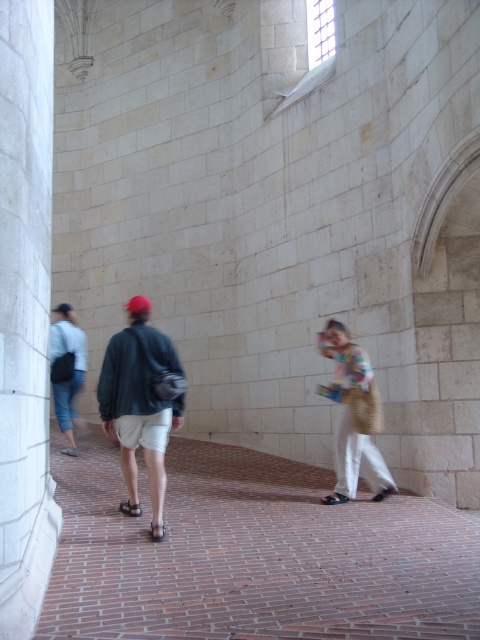
Is black leather sandal at lower left taller than brown leather sandal at lower left?

Indeed, black leather sandal at lower left has a greater height compared to brown leather sandal at lower left.

Is black leather sandal at lower left closer to camera compared to brown leather sandal at lower left?

Yes, it is in front of brown leather sandal at lower left.

Which is in front, point (139, 508) or point (62, 449)?

Point (139, 508) is more forward.

Where is `black leather sandal at lower left`? Image resolution: width=480 pixels, height=640 pixels. black leather sandal at lower left is located at coordinates (130, 508).

Looking at this image, how far apart are denim pants at left and black leather sandal at lower center?

9.61 meters

Does denim pants at left appear under black leather sandal at lower center?

No.

At what (x,y) coordinates should I click in order to perform the action: click on denim pants at left. Please return your answer as a coordinate pair (x, y). Image resolution: width=480 pixels, height=640 pixels. Looking at the image, I should click on (70, 369).

Who is shorter, multicolored woven bag at center or brown leather sandal at lower left?

Standing shorter between the two is brown leather sandal at lower left.

The height and width of the screenshot is (640, 480). What do you see at coordinates (349, 412) in the screenshot?
I see `multicolored woven bag at center` at bounding box center [349, 412].

Where is `multicolored woven bag at center`? The image size is (480, 640). multicolored woven bag at center is located at coordinates (349, 412).